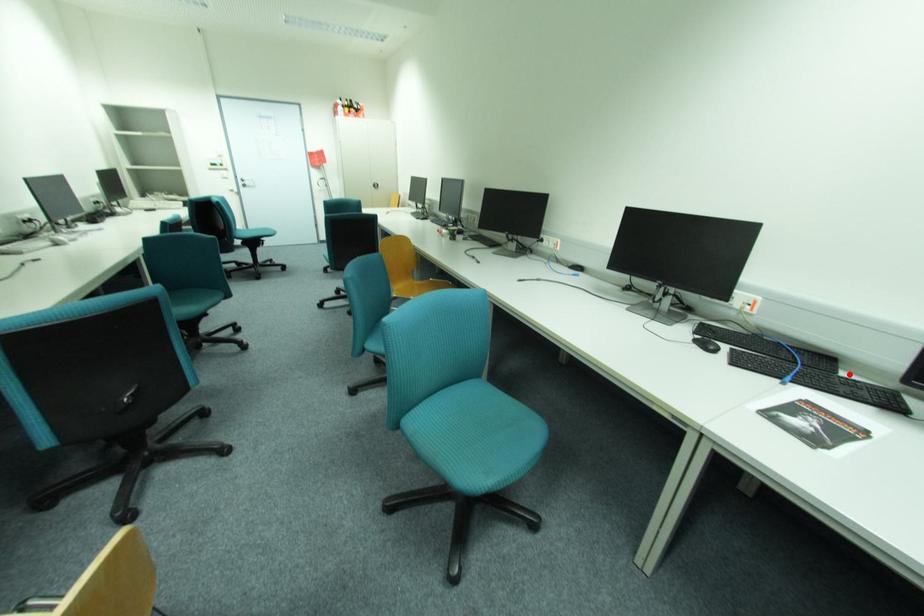
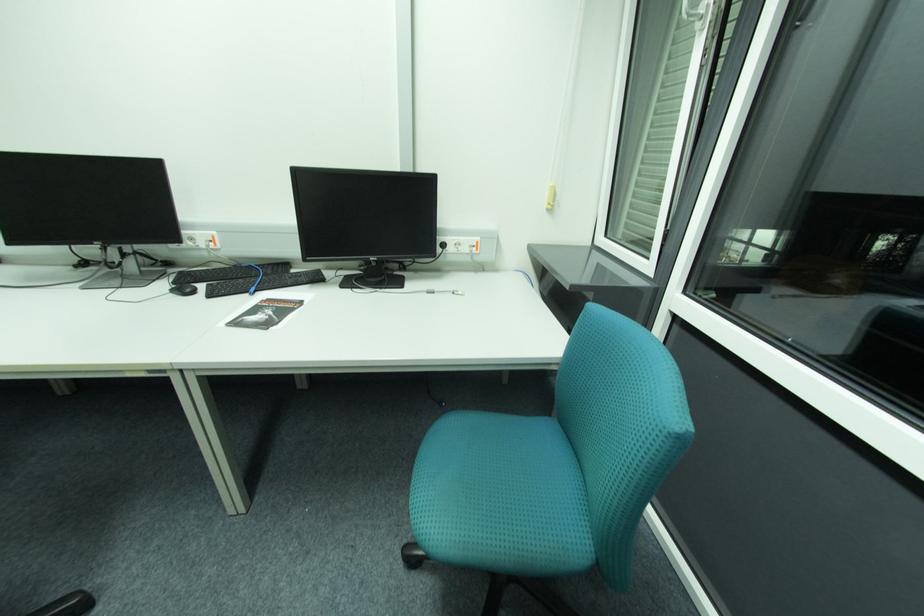
Locate, in the second image, the point that corresponds to the highlighted location in the first image.

(298, 272)